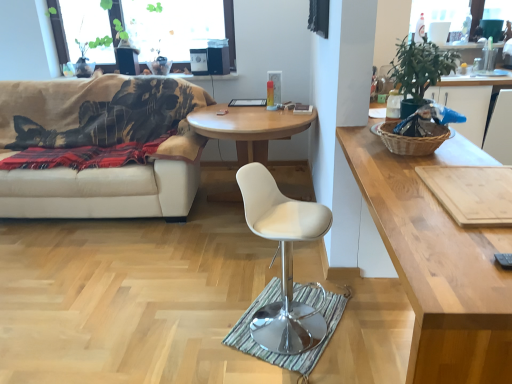
Locate an element on the screen. blank space situated above textured woven mat at center (from a real-world perspective) is located at coordinates pos(279,317).